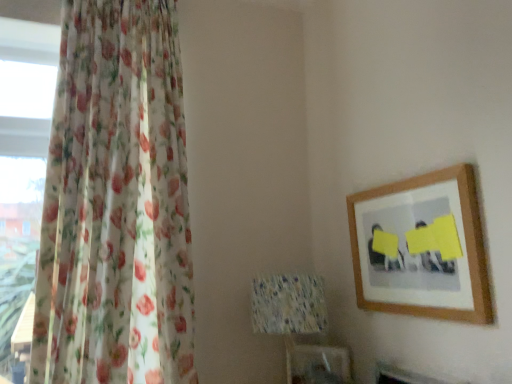
Question: Can you confirm if wooden picture frame at upper right is positioned to the right of speckled fabric lampshade at center?

Choices:
 (A) yes
 (B) no

Answer: (A)

Question: Is wooden picture frame at upper right taller than speckled fabric lampshade at center?

Choices:
 (A) yes
 (B) no

Answer: (B)

Question: Does wooden picture frame at upper right come behind speckled fabric lampshade at center?

Choices:
 (A) no
 (B) yes

Answer: (A)

Question: From a real-world perspective, is wooden picture frame at upper right on speckled fabric lampshade at center?

Choices:
 (A) yes
 (B) no

Answer: (A)

Question: Is wooden picture frame at upper right not near speckled fabric lampshade at center?

Choices:
 (A) no
 (B) yes

Answer: (A)

Question: Relative to floral sheer curtain at left, is speckled fabric lampshade at center in front or behind?

Choices:
 (A) behind
 (B) front

Answer: (A)

Question: Looking at their shapes, would you say speckled fabric lampshade at center is wider or thinner than floral sheer curtain at left?

Choices:
 (A) thin
 (B) wide

Answer: (A)

Question: From the image's perspective, is speckled fabric lampshade at center located above or below floral sheer curtain at left?

Choices:
 (A) below
 (B) above

Answer: (A)

Question: Does point pyautogui.click(x=254, y=301) appear closer or farther from the camera than point pyautogui.click(x=132, y=292)?

Choices:
 (A) closer
 (B) farther

Answer: (B)

Question: Is point (114, 119) closer or farther from the camera than point (401, 244)?

Choices:
 (A) closer
 (B) farther

Answer: (B)

Question: Do you think floral sheer curtain at left is within wooden picture frame at upper right, or outside of it?

Choices:
 (A) inside
 (B) outside

Answer: (B)

Question: From their relative heights in the image, would you say floral sheer curtain at left is taller or shorter than wooden picture frame at upper right?

Choices:
 (A) tall
 (B) short

Answer: (A)

Question: From a real-world perspective, is floral sheer curtain at left positioned above or below wooden picture frame at upper right?

Choices:
 (A) below
 (B) above

Answer: (B)

Question: Is point (106, 288) positioned closer to the camera than point (282, 312)?

Choices:
 (A) closer
 (B) farther

Answer: (A)

Question: Considering the positions of floral sheer curtain at left and speckled fabric lampshade at center in the image, is floral sheer curtain at left taller or shorter than speckled fabric lampshade at center?

Choices:
 (A) tall
 (B) short

Answer: (A)